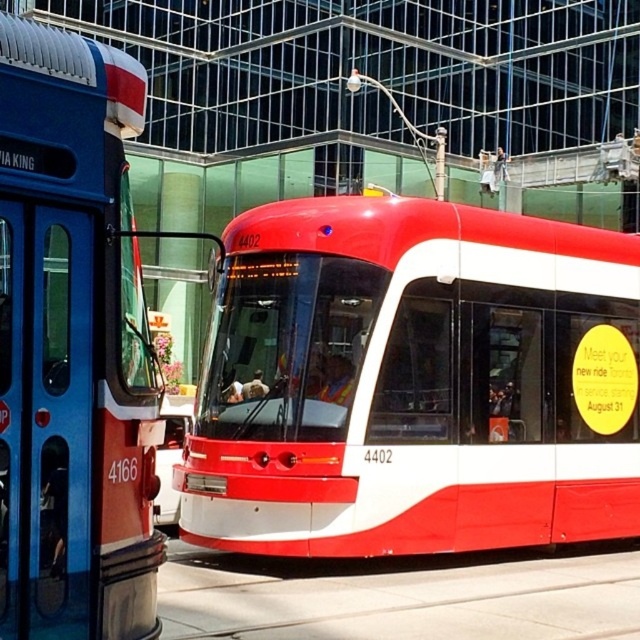
Which is below, shiny red bus at center or matte red bus at left?

shiny red bus at center

You are a GUI agent. You are given a task and a screenshot of the screen. Output one action in this format:
    pyautogui.click(x=<x>, y=<y>)
    Task: Click on the shiny red bus at center
    The height and width of the screenshot is (640, 640).
    Given the screenshot: What is the action you would take?
    pyautogui.click(x=413, y=381)

Describe the element at coordinates (413, 381) in the screenshot. I see `shiny red bus at center` at that location.

Where is `shiny red bus at center`? shiny red bus at center is located at coordinates (413, 381).